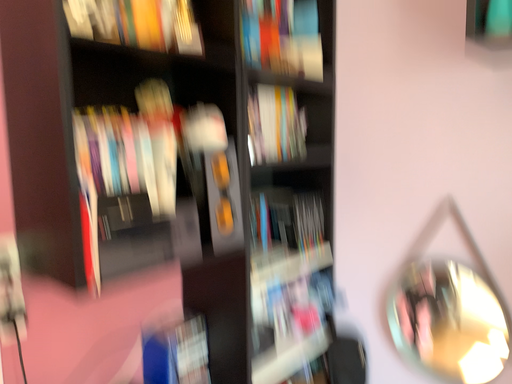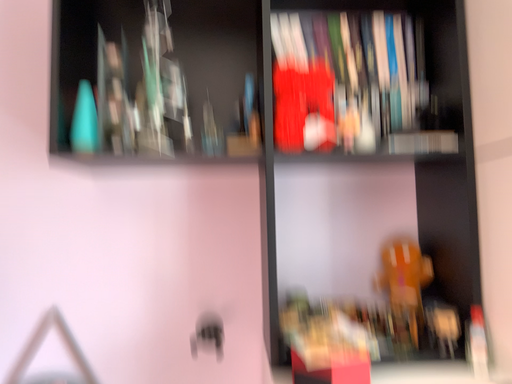
Question: How did the camera likely rotate when shooting the video?

Choices:
 (A) rotated right
 (B) rotated left

Answer: (A)